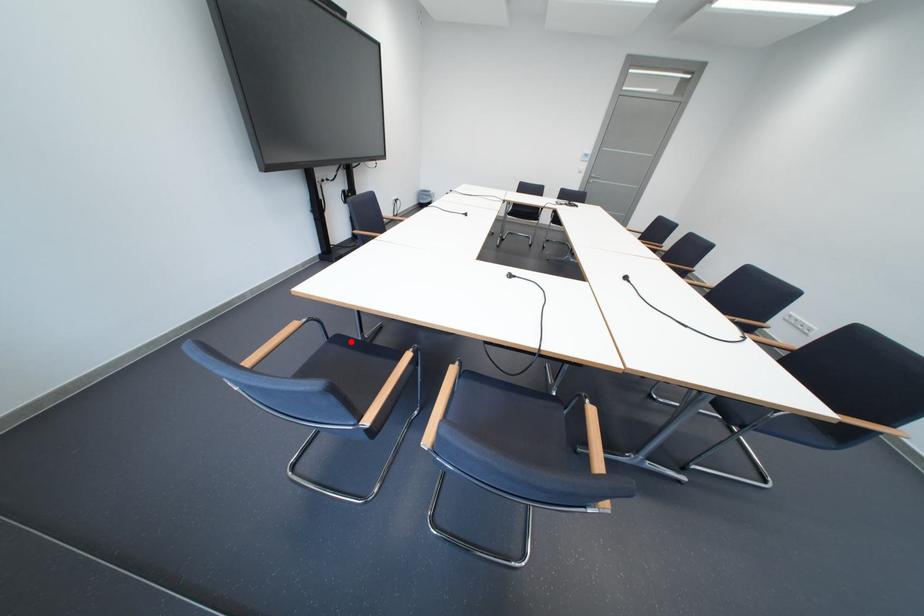
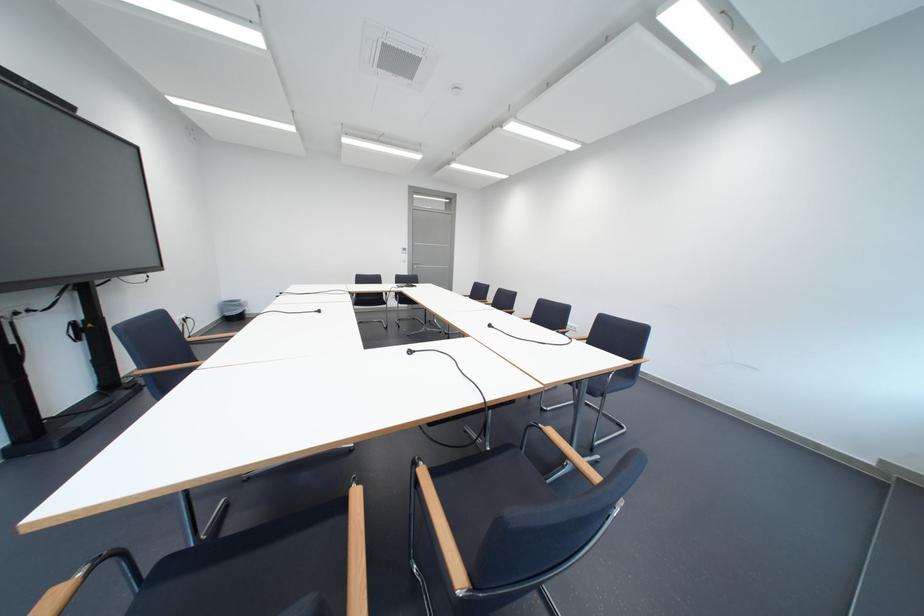
Question: A red point is marked in image1. In image2, is the corresponding 3D point closer to the camera or farther? Reply with the corresponding letter.

Choices:
 (A) The corresponding 3D point is closer.
 (B) The corresponding 3D point is farther.

Answer: (B)